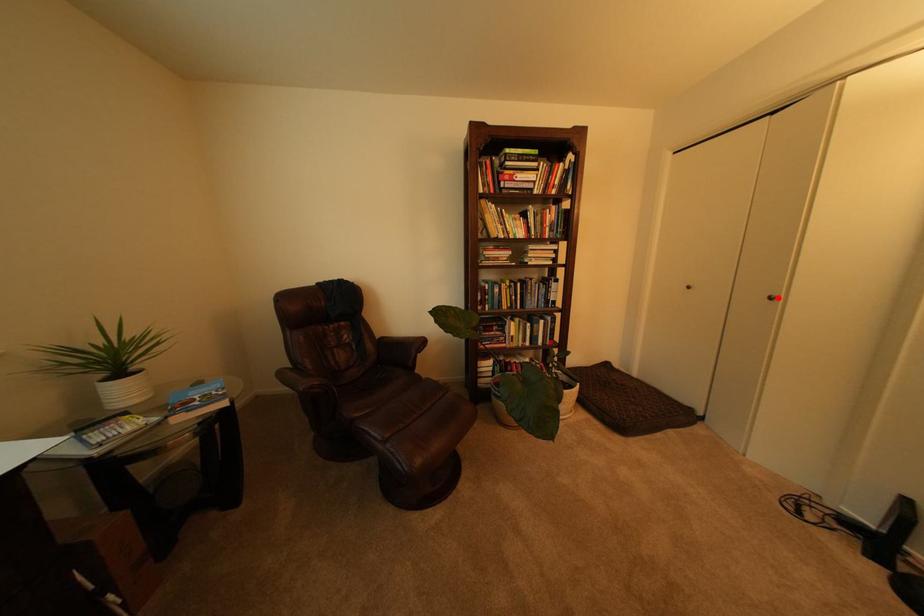
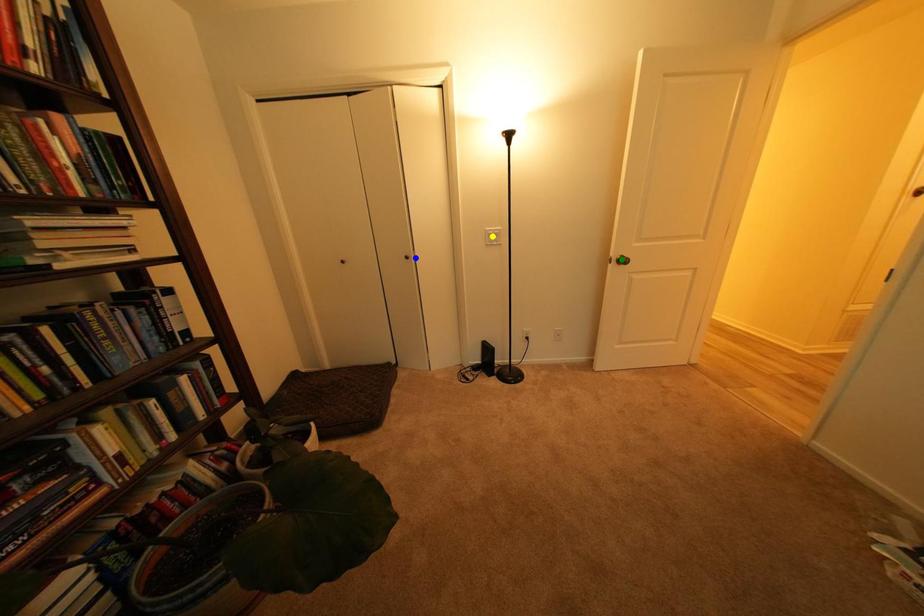
Question: I am providing you with two images of the same scene from different viewpoints. A red point is marked on the first image. You are given multiple points on the second image. Can you choose the point in image 2 that corresponds to the point in image 1?

Choices:
 (A) green point
 (B) yellow point
 (C) blue point

Answer: (C)